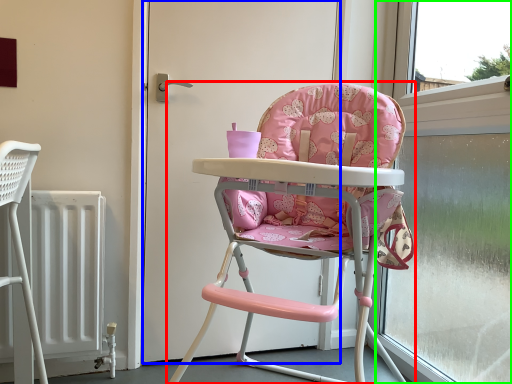
Question: Considering the real-world distances, which object is closest to chair (highlighted by a red box)? door (highlighted by a blue box) or window frame (highlighted by a green box).

Choices:
 (A) door
 (B) window frame

Answer: (A)